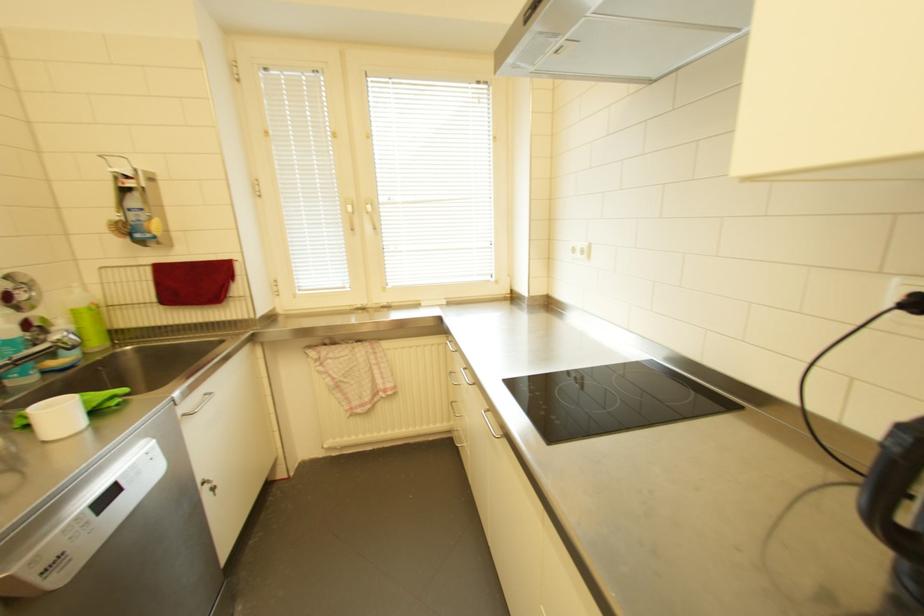
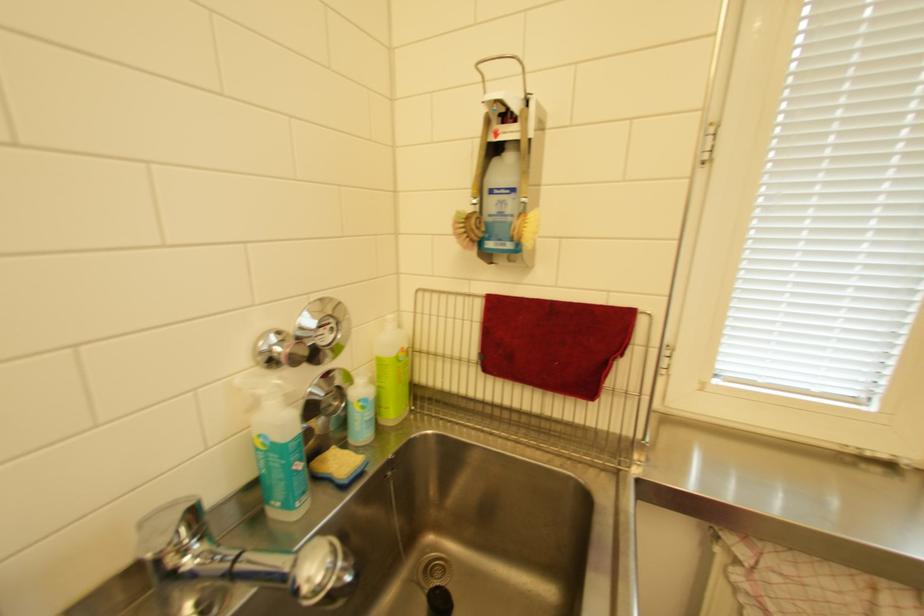
Locate, in the second image, the point that corresponds to point (152, 188) in the first image.

(537, 140)